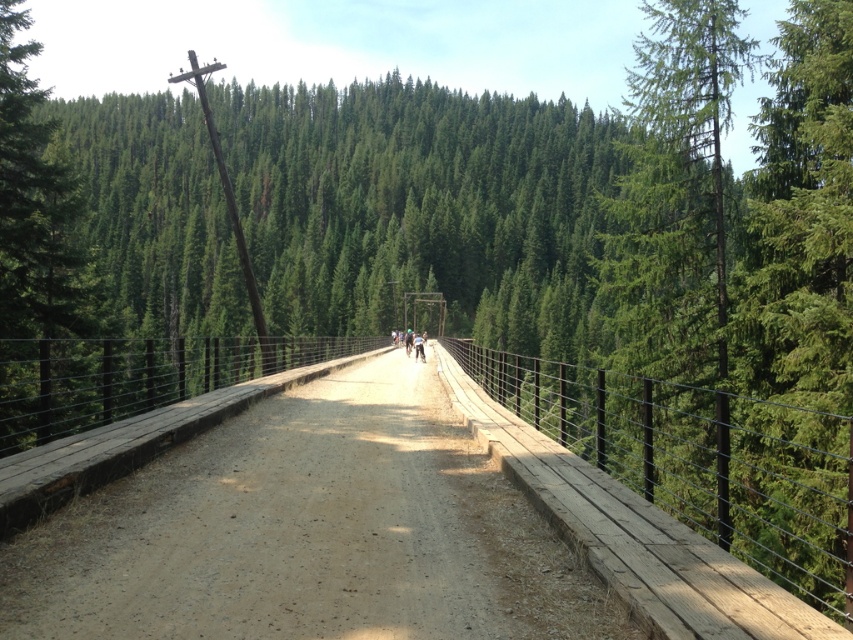
Is green matte tree at left shorter than green fabric cyclist at center?

No.

Which is below, green matte tree at left or green fabric cyclist at center?

green fabric cyclist at center is lower down.

Where is `green matte tree at left`? This screenshot has width=853, height=640. green matte tree at left is located at coordinates (35, 252).

Locate an element on the screen. Image resolution: width=853 pixels, height=640 pixels. green matte tree at left is located at coordinates (35, 252).

Which is above, green evergreen tree at right or green matte tree at left?

green evergreen tree at right

Who is positioned more to the right, green evergreen tree at right or green matte tree at left?

green evergreen tree at right

The image size is (853, 640). Describe the element at coordinates (676, 193) in the screenshot. I see `green evergreen tree at right` at that location.

Image resolution: width=853 pixels, height=640 pixels. In order to click on green evergreen tree at right in this screenshot , I will do `click(676, 193)`.

Does point (450, 586) come in front of point (418, 340)?

Yes, point (450, 586) is closer to viewer.

Between brown wooden bridge at center and green fabric cyclist at center, which one has more height?

brown wooden bridge at center is taller.

Is point (556, 620) more distant than point (421, 355)?

No, (556, 620) is closer to viewer.

The width and height of the screenshot is (853, 640). What are the coordinates of `brown wooden bridge at center` in the screenshot? It's located at (302, 531).